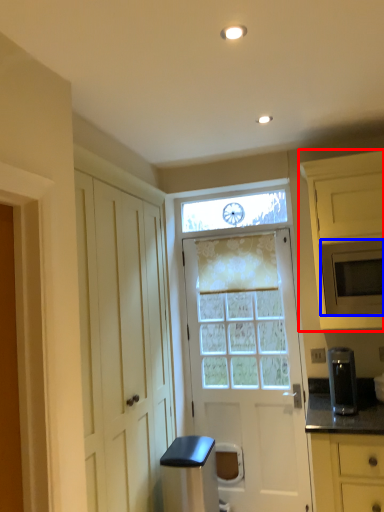
Question: Which point is further to the camera, cabinetry (highlighted by a red box) or microwave oven (highlighted by a blue box)?

Choices:
 (A) cabinetry
 (B) microwave oven

Answer: (B)